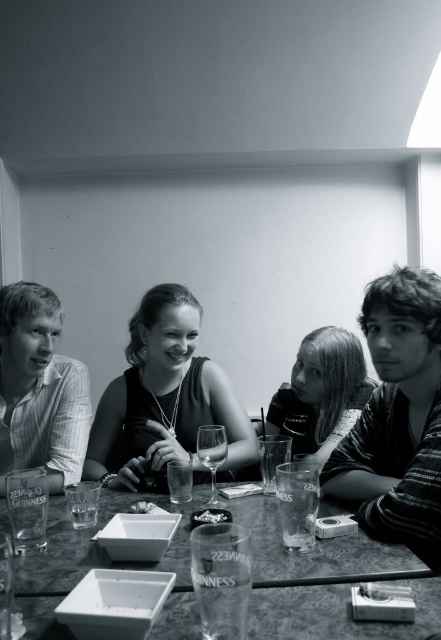
You are a photographer trying to capture a group shot of the striped cotton shirt at left and the smooth black hair at center. Since you want to focus on both subjects equally, which subject should you move closer to the camera to ensure they appear the same size in the photo?

The striped cotton shirt at left is narrower than the smooth black hair at center, so you should move the striped cotton shirt at left closer to the camera to make them appear the same size in the photo.

You are a photographer adjusting your camera to focus on the striped cotton shirt at left and the smooth black hair at center. Which object should you adjust your focus to first if you want to capture both in sharp detail?

You should focus on the striped cotton shirt at left first because it is closer to the viewer than the smooth black hair at center, allowing you to adjust focus from near to far for both subjects.

You are standing in front of the table in the image and want to place a small item on the table. You have two options for placement based on coordinates given in the image. The first option is at point (12, 326) and the second is at point (216, 500). Which point is closer to you?

Point (12, 326) is closer to you because it is further to the viewer than point (216, 500).